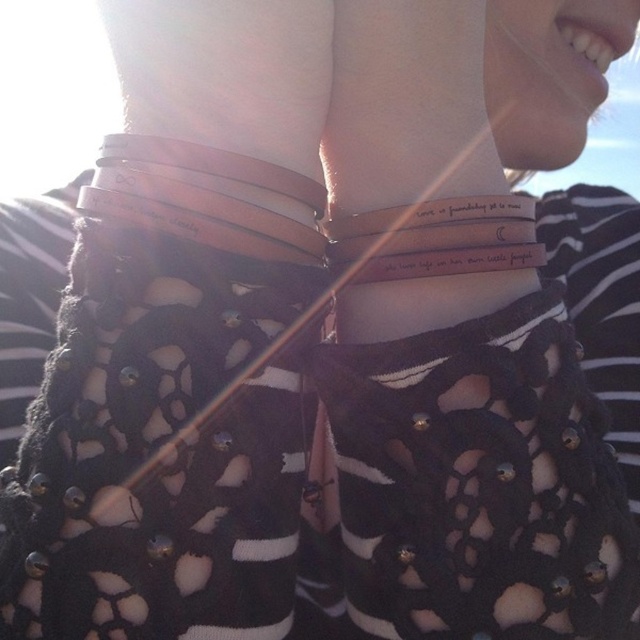
You are a jewelry designer examining the image of layered bracelets. You need to determine the arrangement of the brown leather bracelets at center and the white leather bracelet at center. Which one is located to the right of the other?

The brown leather bracelets at center is positioned on the right side of white leather bracelet at center.

You are taking a photo of the bracelets and need to focus on the closest point to you. Which point should you choose between point (349, 307) and point (419, 236)?

Point (349, 307) is further to the camera than point (419, 236), so you should focus on point (349, 307) as it is closer to you.